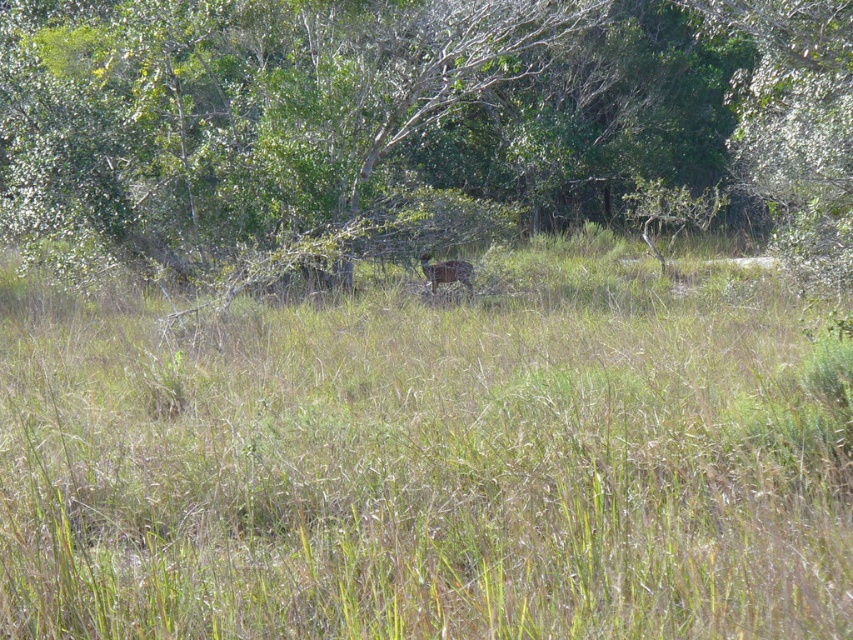
You are an observer in the marshland scene. You see the green grassy at center and the green leafy tree at center. Which object is closer to you?

The green grassy at center is closer to you because it is in front of the green leafy tree at center.